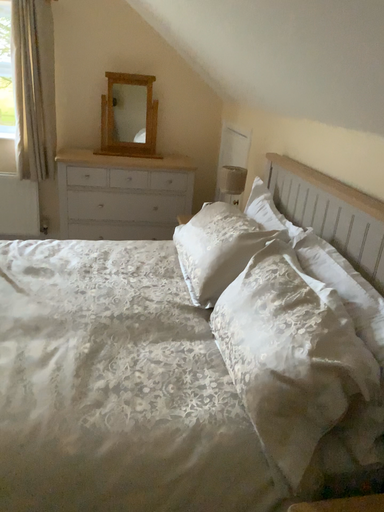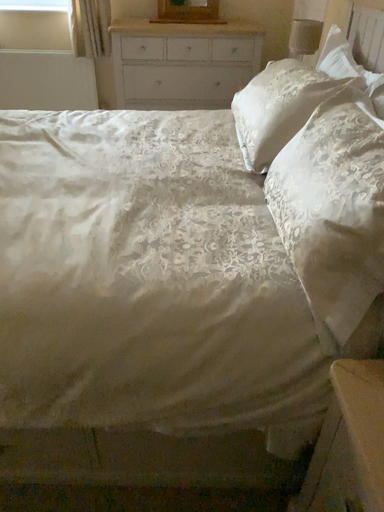
Question: How did the camera likely rotate when shooting the video?

Choices:
 (A) rotated downward
 (B) rotated upward

Answer: (A)